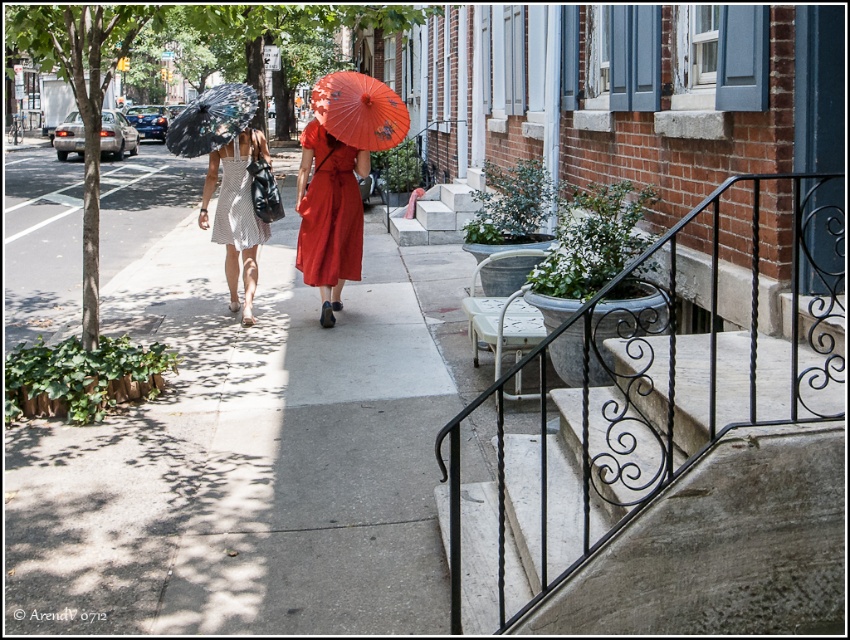
Question: Does shiny black umbrella at center have a greater width compared to white striped dress at center?

Choices:
 (A) yes
 (B) no

Answer: (A)

Question: Which object appears farthest from the camera in this image?

Choices:
 (A) concrete at center
 (B) shiny black umbrella at center
 (C) gray concrete sidewalk at center
 (D) white textured dress at center

Answer: (A)

Question: Estimate the real-world distances between objects in this image. Which object is closer to the matte red dress at center?

Choices:
 (A) white textured dress at center
 (B) concrete at center
 (C) white striped dress at center
 (D) black wrought iron balustrade at center right

Answer: (C)

Question: Does concrete at center lie in front of white striped dress at center?

Choices:
 (A) yes
 (B) no

Answer: (B)

Question: Which point is closer to the camera?

Choices:
 (A) (348, 104)
 (B) (316, 145)
 (C) (421, 205)
 (D) (259, 241)

Answer: (A)

Question: Can you confirm if white textured dress at center is wider than concrete at center?

Choices:
 (A) yes
 (B) no

Answer: (B)